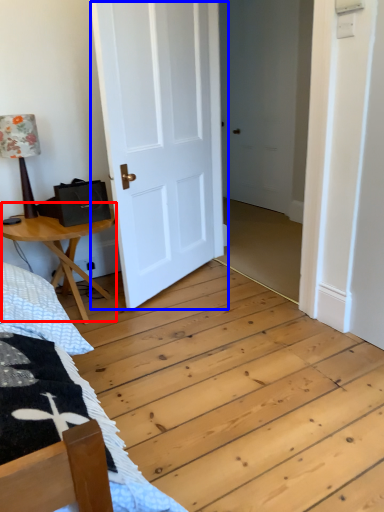
Question: Which point is further to the camera, table (highlighted by a red box) or door (highlighted by a blue box)?

Choices:
 (A) table
 (B) door

Answer: (A)